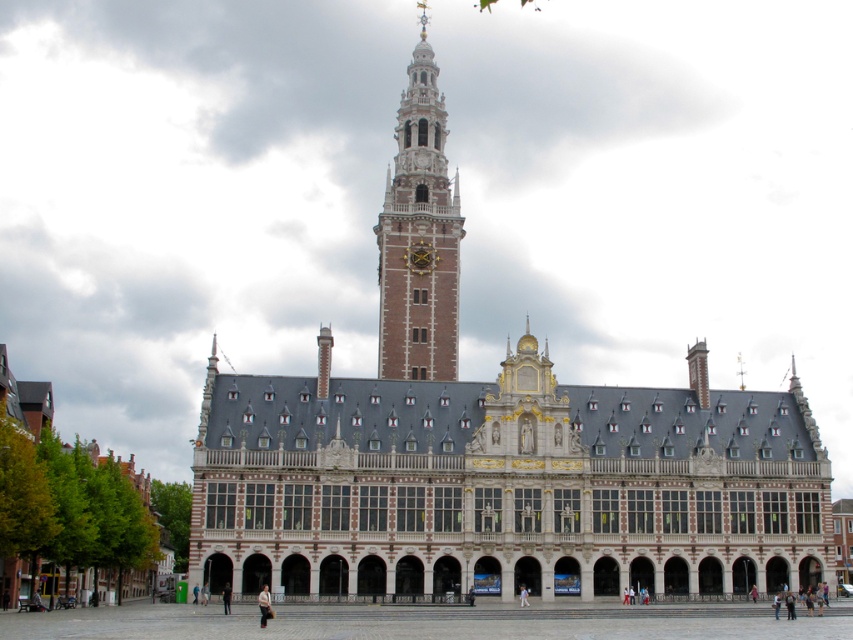
Question: Which object is the closest to the light brown leather jacket at lower center?

Choices:
 (A) dark gray fabric jacket at lower center
 (B) brown brick tower at center

Answer: (A)

Question: Does white stone building at center have a greater width compared to brown brick tower at center?

Choices:
 (A) no
 (B) yes

Answer: (B)

Question: Can you confirm if white stone building at center is positioned above light brown leather jacket at lower center?

Choices:
 (A) yes
 (B) no

Answer: (A)

Question: Which is farther from the brown brick tower at center?

Choices:
 (A) brick stone building at center
 (B) light brown leather jacket at lower center

Answer: (B)

Question: Which is nearer to the light brown leather jacket at lower center?

Choices:
 (A) brown brick tower at center
 (B) white stone building at center
 (C) brick stone building at center

Answer: (B)

Question: Considering the relative positions of light brown leather jacket at lower center and dark gray fabric jacket at lower center in the image provided, where is light brown leather jacket at lower center located with respect to dark gray fabric jacket at lower center?

Choices:
 (A) above
 (B) below

Answer: (A)